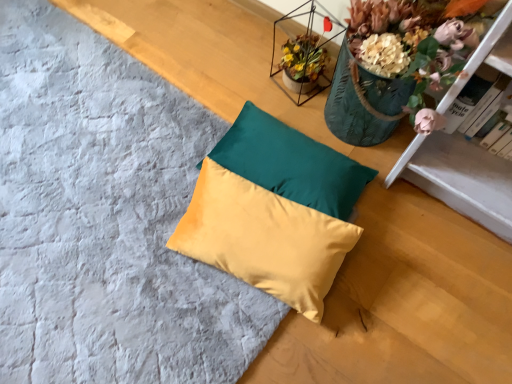
Question: Considering the relative sizes of satin yellow pillow at center, acting as the first pillow starting from the bottom, and satin yellow pillow at center, marked as the second pillow in a bottom-to-top arrangement, in the image provided, is satin yellow pillow at center, acting as the first pillow starting from the bottom, taller than satin yellow pillow at center, marked as the second pillow in a bottom-to-top arrangement,?

Choices:
 (A) no
 (B) yes

Answer: (B)

Question: Considering the relative sizes of satin yellow pillow at center, acting as the first pillow starting from the bottom, and satin yellow pillow at center, marked as the second pillow in a bottom-to-top arrangement, in the image provided, is satin yellow pillow at center, acting as the first pillow starting from the bottom, thinner than satin yellow pillow at center, marked as the second pillow in a bottom-to-top arrangement,?

Choices:
 (A) no
 (B) yes

Answer: (A)

Question: Is satin yellow pillow at center, acting as the first pillow starting from the bottom, not near satin yellow pillow at center, placed as the first pillow when sorted from top to bottom?

Choices:
 (A) yes
 (B) no

Answer: (B)

Question: Can you confirm if satin yellow pillow at center, acting as the first pillow starting from the bottom, is positioned to the right of satin yellow pillow at center, placed as the first pillow when sorted from top to bottom?

Choices:
 (A) yes
 (B) no

Answer: (B)

Question: Can satin yellow pillow at center, marked as the second pillow in a bottom-to-top arrangement, be found inside satin yellow pillow at center, which is the 2th pillow in top-to-bottom order?

Choices:
 (A) yes
 (B) no

Answer: (B)

Question: Does satin yellow pillow at center, which is the 2th pillow in top-to-bottom order, lie in front of satin yellow pillow at center, placed as the first pillow when sorted from top to bottom?

Choices:
 (A) no
 (B) yes

Answer: (B)

Question: Is hardcover book at upper right looking in the opposite direction of satin yellow pillow at center, acting as the first pillow starting from the bottom?

Choices:
 (A) yes
 (B) no

Answer: (B)

Question: Is hardcover book at upper right shorter than satin yellow pillow at center, which is the 2th pillow in top-to-bottom order?

Choices:
 (A) yes
 (B) no

Answer: (B)

Question: Can satin yellow pillow at center, which is the 2th pillow in top-to-bottom order, be found inside hardcover book at upper right?

Choices:
 (A) yes
 (B) no

Answer: (B)

Question: Considering the relative sizes of hardcover book at upper right and satin yellow pillow at center, acting as the first pillow starting from the bottom, in the image provided, is hardcover book at upper right thinner than satin yellow pillow at center, acting as the first pillow starting from the bottom,?

Choices:
 (A) yes
 (B) no

Answer: (A)

Question: Is hardcover book at upper right smaller than satin yellow pillow at center, which is the 2th pillow in top-to-bottom order?

Choices:
 (A) yes
 (B) no

Answer: (A)

Question: Does hardcover book at upper right appear on the left side of satin yellow pillow at center, acting as the first pillow starting from the bottom?

Choices:
 (A) no
 (B) yes

Answer: (A)

Question: Is satin yellow pillow at center, acting as the first pillow starting from the bottom, to the right of hardcover book at upper right from the viewer's perspective?

Choices:
 (A) no
 (B) yes

Answer: (A)